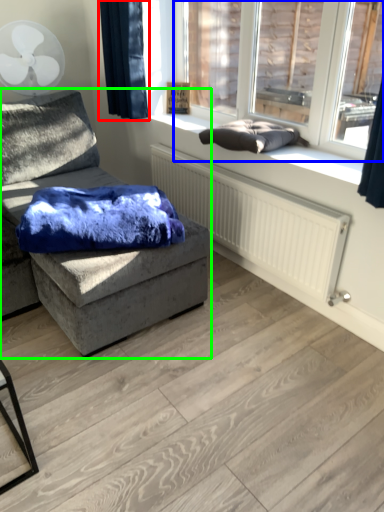
Question: Based on their relative distances, which object is farther from curtain (highlighted by a red box)? Choose from window (highlighted by a blue box) and studio couch (highlighted by a green box).

Choices:
 (A) window
 (B) studio couch

Answer: (A)